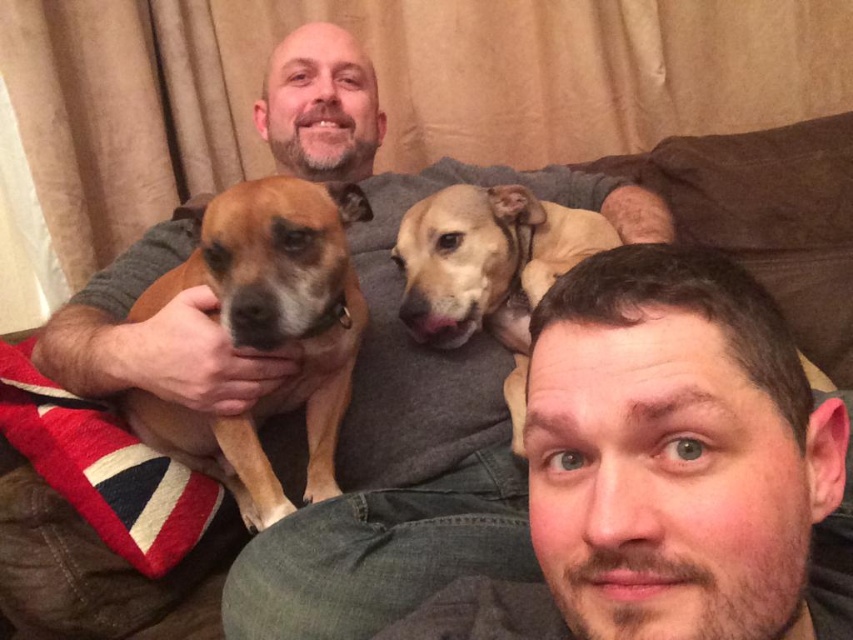
Question: Can you confirm if smooth brown dog at upper center is positioned to the right of fuzzy brown dog at center?

Choices:
 (A) no
 (B) yes

Answer: (B)

Question: Can you confirm if smooth brown dog at upper center is positioned below fuzzy brown dog at center?

Choices:
 (A) no
 (B) yes

Answer: (B)

Question: Does smooth brown dog at upper center have a smaller size compared to brown fur dog at left?

Choices:
 (A) yes
 (B) no

Answer: (A)

Question: Which point is farther to the camera?

Choices:
 (A) (341, 371)
 (B) (425, 308)

Answer: (A)

Question: Estimate the real-world distances between objects in this image. Which object is farther from the brown fur dog at left?

Choices:
 (A) fuzzy brown dog at center
 (B) smooth brown dog at upper center

Answer: (B)

Question: Which point is closer to the camera?

Choices:
 (A) (701, 292)
 (B) (439, 323)

Answer: (A)